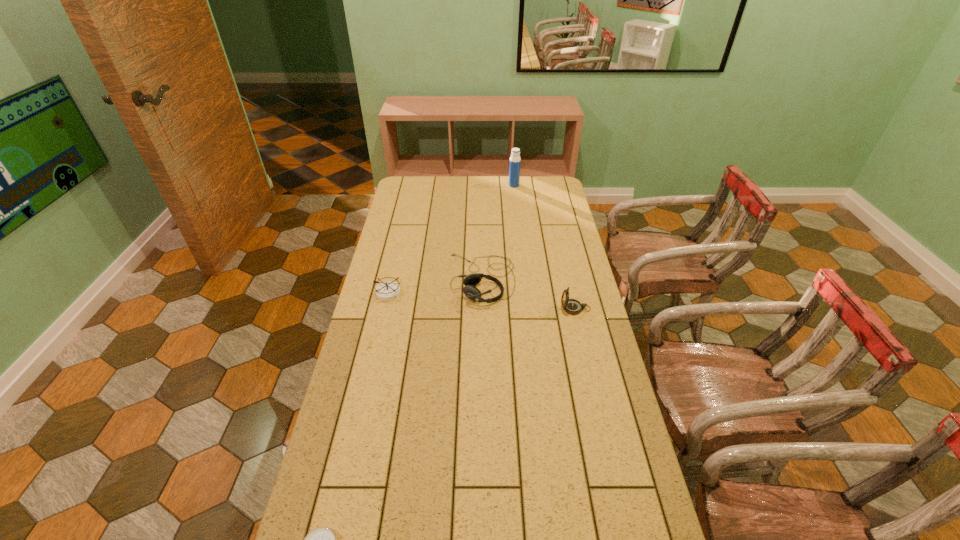
Where is `free space located 0.220m on the face of the rightmost object`? The width and height of the screenshot is (960, 540). free space located 0.220m on the face of the rightmost object is located at coordinates (500, 308).

Where is `blank area located on the face of the rightmost object`? blank area located on the face of the rightmost object is located at coordinates (533, 308).

Where is `free region located on the outer surface of the third object from left to right`? This screenshot has width=960, height=540. free region located on the outer surface of the third object from left to right is located at coordinates (384, 279).

Locate an element on the screen. vacant space located on the outer surface of the third object from left to right is located at coordinates (410, 279).

At what (x,y) coordinates should I click in order to perform the action: click on free location located on the outer surface of the third object from left to right. Please return your answer as a coordinate pair (x, y). Looking at the image, I should click on (376, 279).

You are a GUI agent. You are given a task and a screenshot of the screen. Output one action in this format:
    pyautogui.click(x=<x>, y=<y>)
    Task: Click on the vacant space located 0.370m on the right of the second shortest compass
    The image size is (960, 540).
    Given the screenshot: What is the action you would take?
    pyautogui.click(x=500, y=293)

Where is `object that is at the far edge`? This screenshot has width=960, height=540. object that is at the far edge is located at coordinates (515, 161).

This screenshot has width=960, height=540. In order to click on object that is at the left edge in this screenshot , I will do `click(387, 291)`.

Where is `object positioned at the right edge`? Image resolution: width=960 pixels, height=540 pixels. object positioned at the right edge is located at coordinates (571, 306).

Where is `vacant area at the far edge`? vacant area at the far edge is located at coordinates (460, 178).